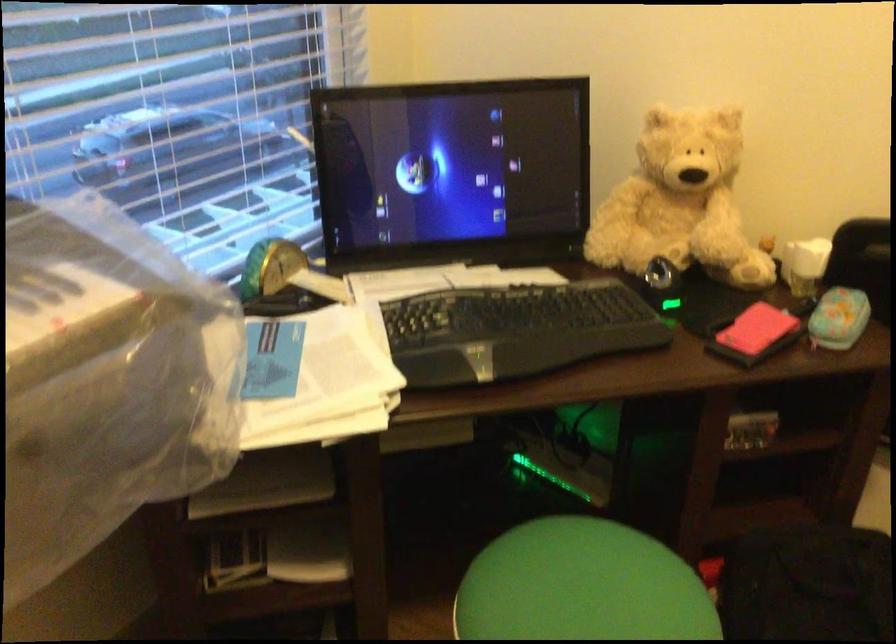
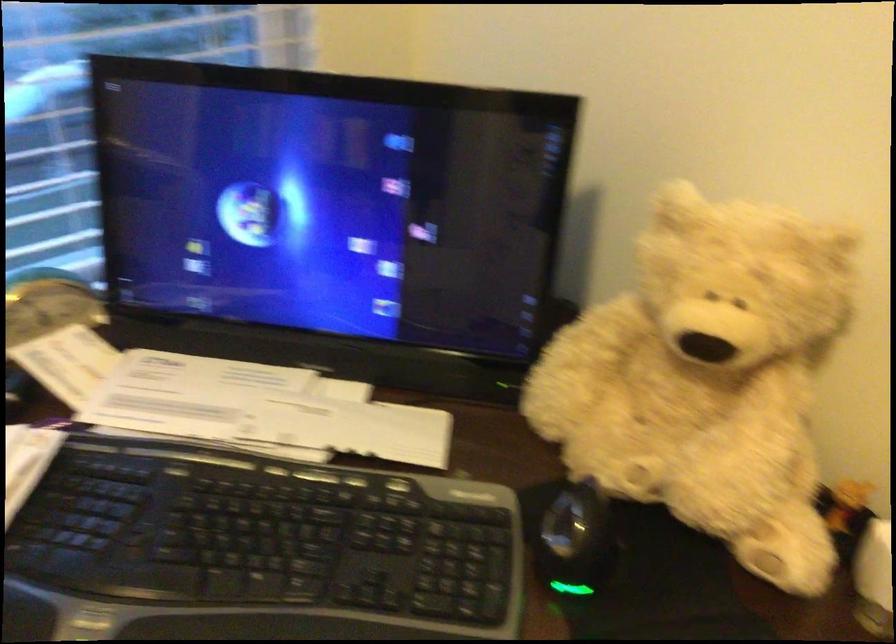
Question: The camera is either moving clockwise (left) or counter-clockwise (right) around the object. The first image is from the beginning of the video and the second image is from the end. Is the camera moving left or right when shooting the video?

Choices:
 (A) Left
 (B) Right

Answer: (B)